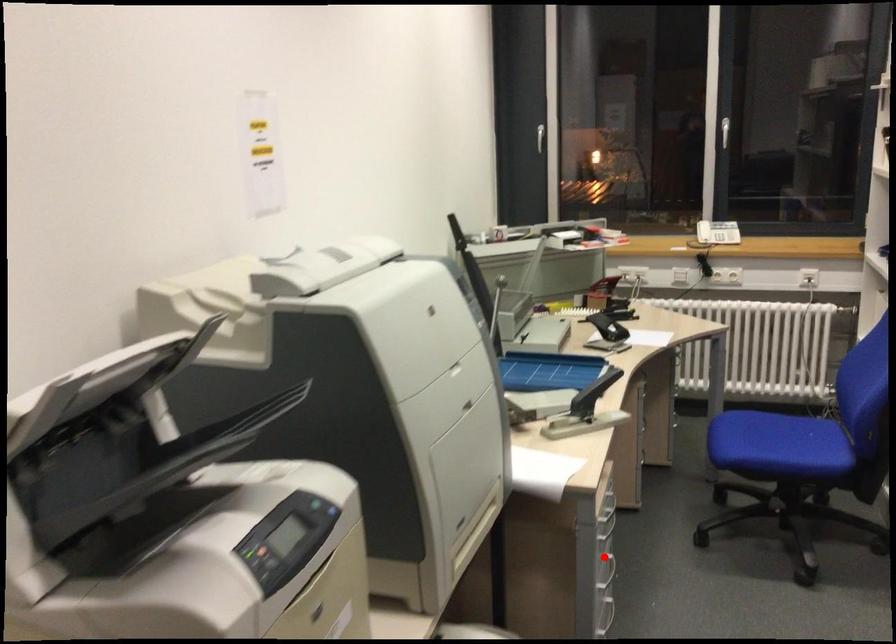
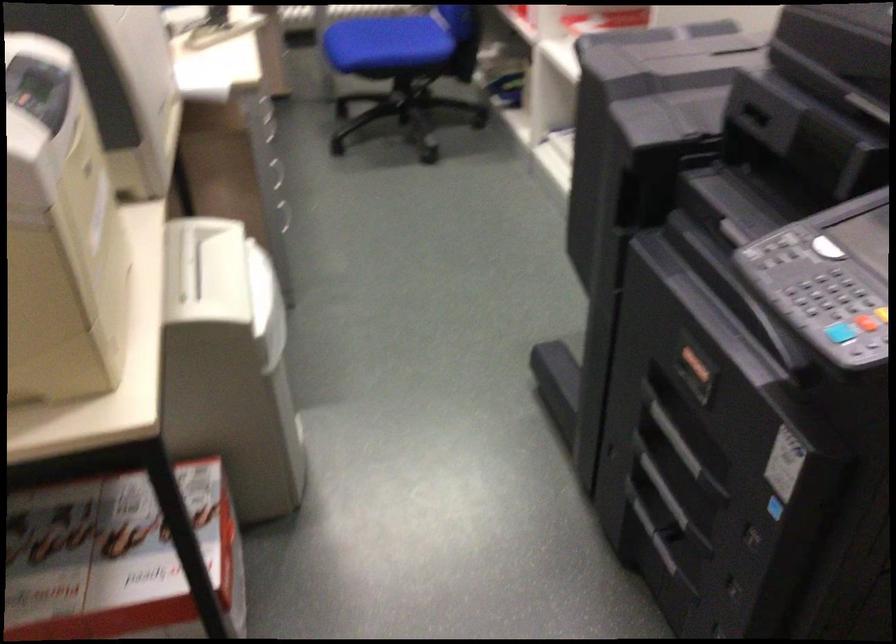
Question: I am providing you with two images of the same scene from different viewpoints. A red point is marked on the first image. Is the red point's position out of view in image 2?

Choices:
 (A) Yes
 (B) No

Answer: (A)